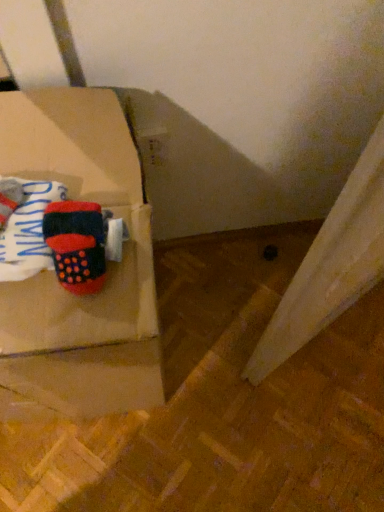
Find the location of a particular element. knitted wool socks at left is located at coordinates click(x=29, y=232).

This screenshot has height=512, width=384. Describe the element at coordinates (29, 232) in the screenshot. I see `knitted wool socks at left` at that location.

Describe the element at coordinates (76, 244) in the screenshot. I see `velvet-like red phone at upper left` at that location.

The width and height of the screenshot is (384, 512). Find the location of `velvet-like red phone at upper left`. velvet-like red phone at upper left is located at coordinates (76, 244).

The height and width of the screenshot is (512, 384). I want to click on knitted wool socks at left, so click(29, 232).

From a real-world perspective, is velvet-like red phone at upper left physically below knitted wool socks at left?

Yes, from a real-world perspective, velvet-like red phone at upper left is below knitted wool socks at left.

Is velvet-like red phone at upper left aimed at knitted wool socks at left?

No, velvet-like red phone at upper left is not facing towards knitted wool socks at left.

In the image, is velvet-like red phone at upper left positioned in front of or behind knitted wool socks at left?

velvet-like red phone at upper left is behind knitted wool socks at left.

Measure the distance between velvet-like red phone at upper left and knitted wool socks at left.

velvet-like red phone at upper left and knitted wool socks at left are 1.27 inches apart from each other.

From their relative heights in the image, would you say matte cardboard box at left is taller or shorter than velvet-like red phone at upper left?

In the image, matte cardboard box at left appears to be taller than velvet-like red phone at upper left.

Measure the distance from matte cardboard box at left to velvet-like red phone at upper left.

matte cardboard box at left is 7.04 inches away from velvet-like red phone at upper left.

Would you say velvet-like red phone at upper left is part of matte cardboard box at left's contents?

Yes.

Looking at this image, from the image's perspective, between matte cardboard box at left and velvet-like red phone at upper left, who is located below?

matte cardboard box at left appears lower in the image.

From the image's perspective, is velvet-like red phone at upper left located above or below matte cardboard box at left?

velvet-like red phone at upper left is situated higher than matte cardboard box at left in the image.

Considering the sizes of objects velvet-like red phone at upper left and matte cardboard box at left in the image provided, who is bigger, velvet-like red phone at upper left or matte cardboard box at left?

Bigger between the two is matte cardboard box at left.

From a real-world perspective, is velvet-like red phone at upper left physically above matte cardboard box at left?

Correct, in the physical world, velvet-like red phone at upper left is higher than matte cardboard box at left.

Can you tell me how much velvet-like red phone at upper left and matte cardboard box at left differ in facing direction?

1.43 degrees.

From the picture: Does matte cardboard box at left appear on the left side of knitted wool socks at left?

Indeed, matte cardboard box at left is positioned on the left side of knitted wool socks at left.

From a real-world perspective, which object stands above the other?

knitted wool socks at left is physically above.

Is matte cardboard box at left positioned with its back to knitted wool socks at left?

matte cardboard box at left does not have its back to knitted wool socks at left.

Considering the sizes of matte cardboard box at left and knitted wool socks at left in the image, is matte cardboard box at left bigger or smaller than knitted wool socks at left?

In the image, matte cardboard box at left appears to be larger than knitted wool socks at left.

From the image's perspective, relative to velvet-like red phone at upper left, is knitted wool socks at left above or below?

Clearly, from the image's perspective, knitted wool socks at left is above velvet-like red phone at upper left.

Is the surface of knitted wool socks at left in direct contact with velvet-like red phone at upper left?

Yes.

How much distance is there between knitted wool socks at left and velvet-like red phone at upper left?

knitted wool socks at left is 1.27 inches from velvet-like red phone at upper left.

Is knitted wool socks at left thinner than velvet-like red phone at upper left?

In fact, knitted wool socks at left might be wider than velvet-like red phone at upper left.

Locate an element on the screen. The height and width of the screenshot is (512, 384). box lying on the left of knitted wool socks at left is located at coordinates (55, 276).

Considering the positions of objects knitted wool socks at left and matte cardboard box at left in the image provided, who is behind, knitted wool socks at left or matte cardboard box at left?

knitted wool socks at left is further away from the camera.

The image size is (384, 512). Find the location of `footwear below the knitted wool socks at left (from the image's perspective)`. footwear below the knitted wool socks at left (from the image's perspective) is located at coordinates (76, 244).

The width and height of the screenshot is (384, 512). I want to click on box that appears in front of the velvet-like red phone at upper left, so click(55, 276).

Considering their positions, is knitted wool socks at left positioned closer to velvet-like red phone at upper left than matte cardboard box at left?

The object closer to velvet-like red phone at upper left is knitted wool socks at left.

Based on their spatial positions, is matte cardboard box at left or knitted wool socks at left further from velvet-like red phone at upper left?

matte cardboard box at left is positioned further to the anchor velvet-like red phone at upper left.

Based on their spatial positions, is velvet-like red phone at upper left or matte cardboard box at left closer to knitted wool socks at left?

The object closer to knitted wool socks at left is velvet-like red phone at upper left.

Estimate the real-world distances between objects in this image. Which object is further from knitted wool socks at left, matte cardboard box at left or velvet-like red phone at upper left?

→ matte cardboard box at left is positioned further to the anchor knitted wool socks at left.

When comparing their distances from matte cardboard box at left, does velvet-like red phone at upper left or knitted wool socks at left seem closer?

Based on the image, velvet-like red phone at upper left appears to be nearer to matte cardboard box at left.

Looking at the image, which one is located further to matte cardboard box at left, knitted wool socks at left or velvet-like red phone at upper left?

Among the two, knitted wool socks at left is located further to matte cardboard box at left.

This screenshot has height=512, width=384. I want to click on clothing between matte cardboard box at left and velvet-like red phone at upper left in the horizontal direction, so click(x=29, y=232).